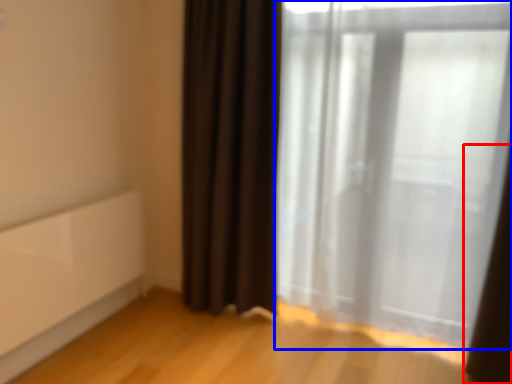
Question: Among these objects, which one is farthest to the camera, curtain (highlighted by a red box) or curtain (highlighted by a blue box)?

Choices:
 (A) curtain
 (B) curtain

Answer: (B)